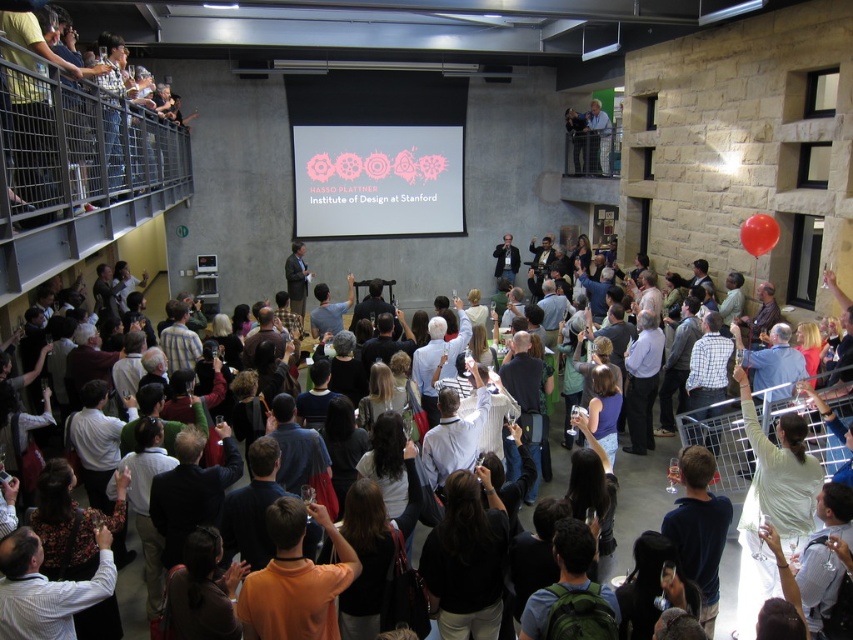
Based on the photo, you are setting up a presentation and need to place the pink fabric projection screen at center and the matte black laptop at center on a table. Given that the laptop needs to be positioned below the screen for optimal visibility, is this arrangement possible based on their sizes?

The pink fabric projection screen at center has a greater height compared to the matte black laptop at center. Since the laptop needs to be positioned below the screen, this arrangement is possible as the screen is taller than the laptop.

You are standing at the entrance of the venue and see a point marked at coordinates (641, 497). Which object is this point located on?

The point is located on the matte black laptop at center.

You are a photographer at the event and need to position yourself so that both the pink fabric projection screen at center and the matte black laptop at center are visible in your shot. Based on their positions, which object should you focus on to ensure both are in frame?

The pink fabric projection screen at center is located above the matte black laptop at center, so focusing on the screen will ensure both are visible in the frame.